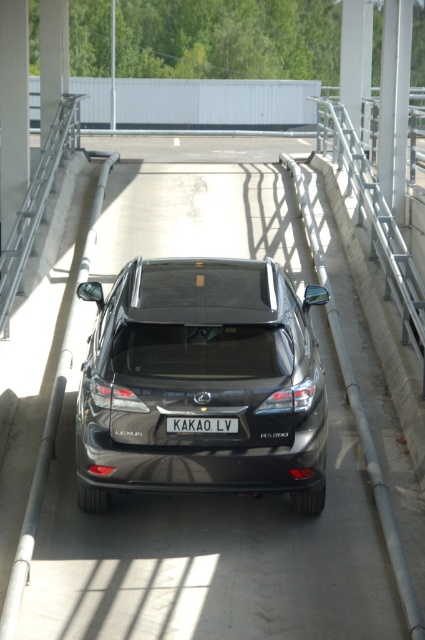
Between satin black suv at center and white plastic license plate at center, which one has more height?

Standing taller between the two is satin black suv at center.

Consider the image. Is satin black suv at center to the left of white plastic license plate at center from the viewer's perspective?

In fact, satin black suv at center is to the right of white plastic license plate at center.

Which is behind, point (255, 326) or point (218, 426)?

The point (255, 326) is behind.

Find the location of a particular element. The width and height of the screenshot is (425, 640). satin black suv at center is located at coordinates (201, 381).